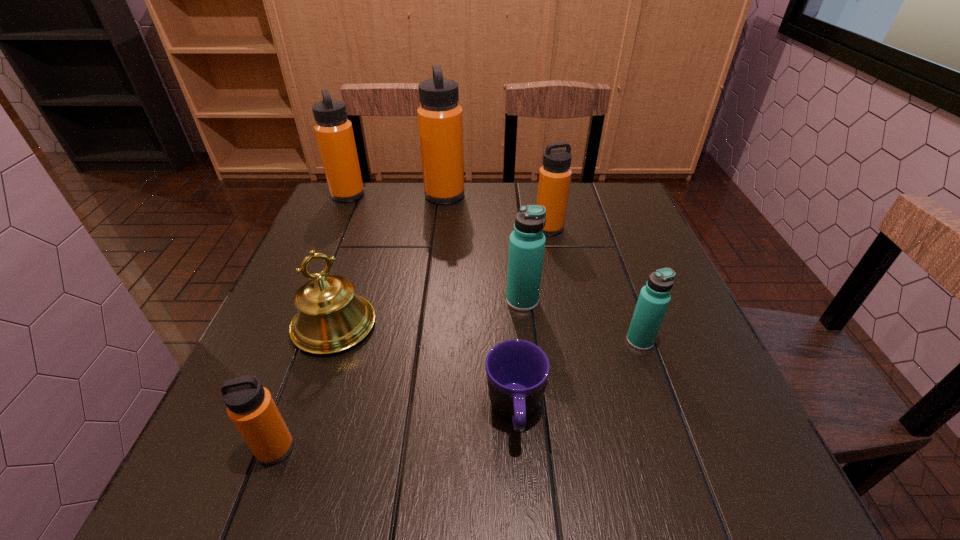
In the image, there is a desktop. What are the coordinates of `vacant region at the near edge` in the screenshot? It's located at (415, 474).

In the image, there is a desktop. In order to click on vacant area at the right edge in this screenshot , I will do `click(618, 309)`.

The image size is (960, 540). Identify the location of vacant space at the far right corner of the desktop. [x=600, y=188].

Where is `blank area at the near right corner`? This screenshot has width=960, height=540. blank area at the near right corner is located at coordinates (684, 486).

Image resolution: width=960 pixels, height=540 pixels. Identify the location of free spot between the fourth object from left to right and the left aqua thermos bottle. (484, 248).

Locate an element on the screen. The width and height of the screenshot is (960, 540). vacant area that lies between the shortest object and the fifth shortest thermos bottle is located at coordinates (431, 303).

Identify the location of empty location between the seventh shortest object and the tallest thermos bottle. The image size is (960, 540). (396, 195).

This screenshot has height=540, width=960. In order to click on free space between the fourth thermos bottle from right to left and the seventh object from left to right in this screenshot , I will do `click(497, 212)`.

The image size is (960, 540). I want to click on vacant area that lies between the bell and the left aqua thermos bottle, so click(428, 313).

Locate an element on the screen. The width and height of the screenshot is (960, 540). empty location between the nearer aqua thermos bottle and the gold bell is located at coordinates (487, 333).